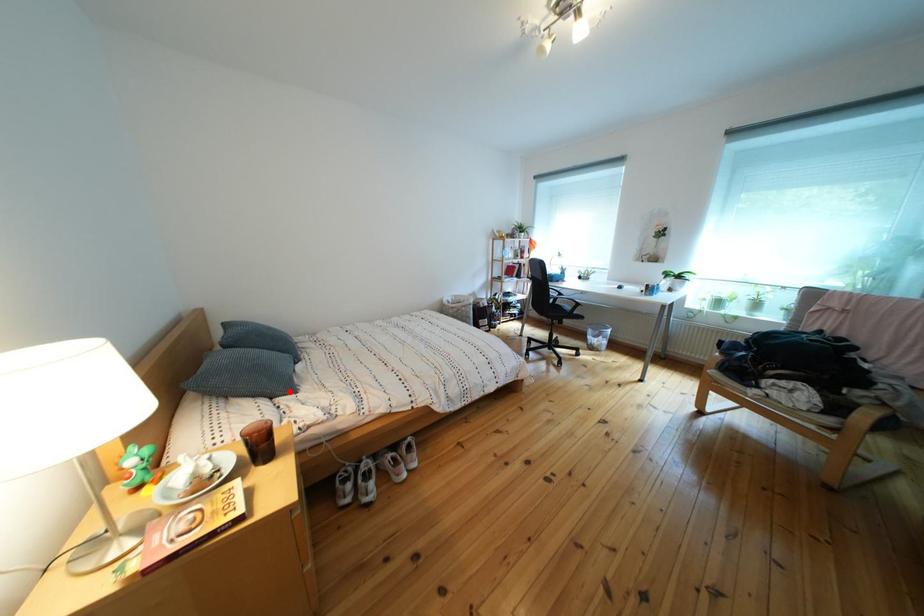
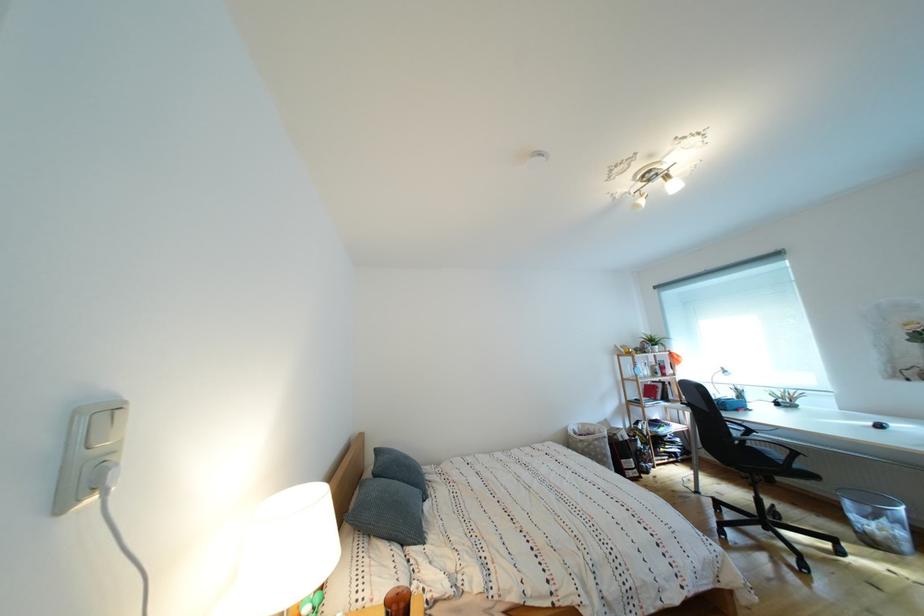
The point at the highlighted location is marked in the first image. Where is the corresponding point in the second image?

(420, 536)